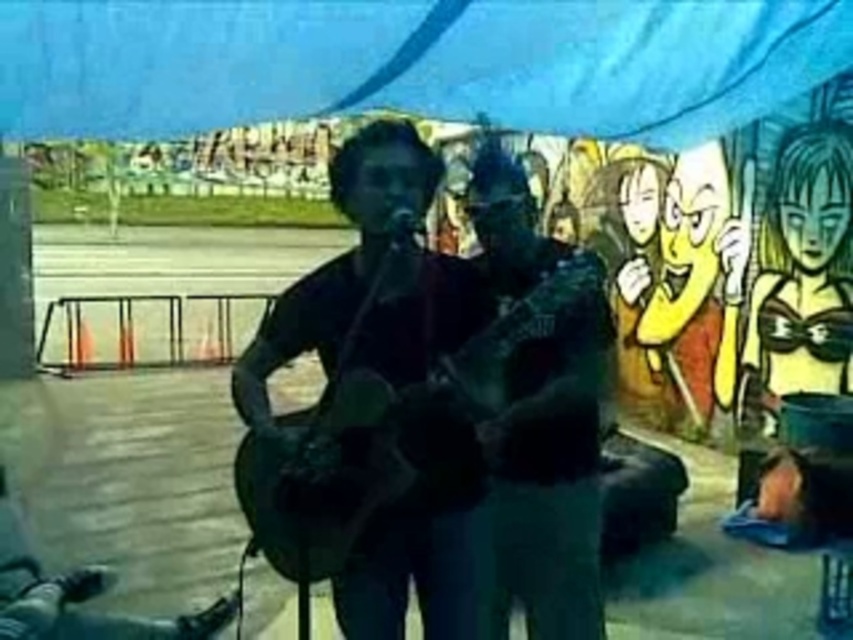
In the scene shown: You are setting up a music stand between the wooden acoustic guitar at center and the dark green fabric guitar at center. Which guitar should you place the stand closer to to ensure it doesn

The wooden acoustic guitar at center is shorter than the dark green fabric guitar at center, so placing the stand closer to the wooden acoustic guitar at center would provide better accessibility since it has a lower profile.

You are setting up a music stand between the wooden acoustic guitar at center and the dark green fabric guitar at center. Which guitar should you place closer to the stand to ensure there is enough space for both guitars and the stand?

The wooden acoustic guitar at center is wider than the dark green fabric guitar at center, so place the dark green fabric guitar at center closer to the stand to accommodate the wider wooden acoustic guitar at center.